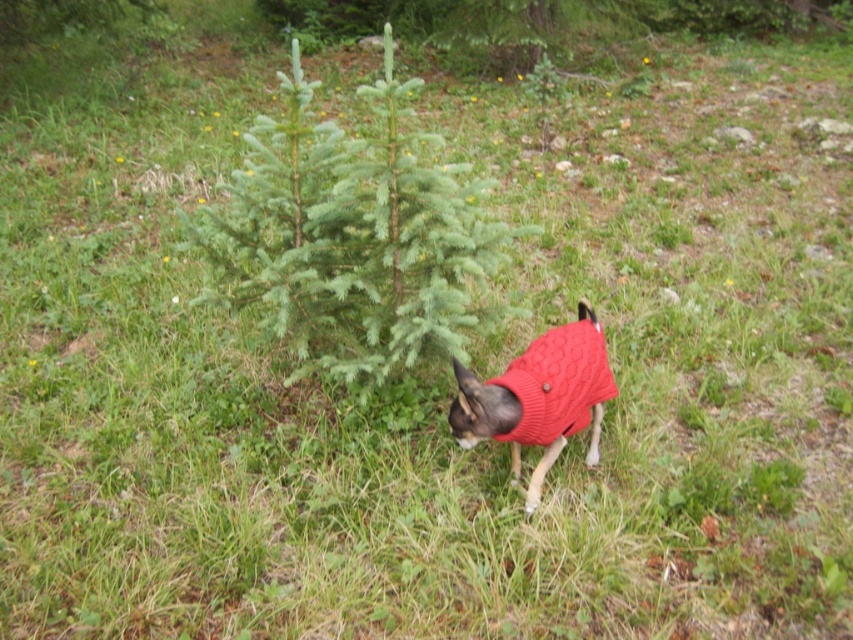
Is green needle-like fir tree at center taller than cable-knit sweater at lower right?

Indeed, green needle-like fir tree at center has a greater height compared to cable-knit sweater at lower right.

Is green needle-like fir tree at center to the left of cable-knit sweater at lower right from the viewer's perspective?

Yes, green needle-like fir tree at center is to the left of cable-knit sweater at lower right.

Where is `green needle-like fir tree at center`? The image size is (853, 640). green needle-like fir tree at center is located at coordinates (352, 237).